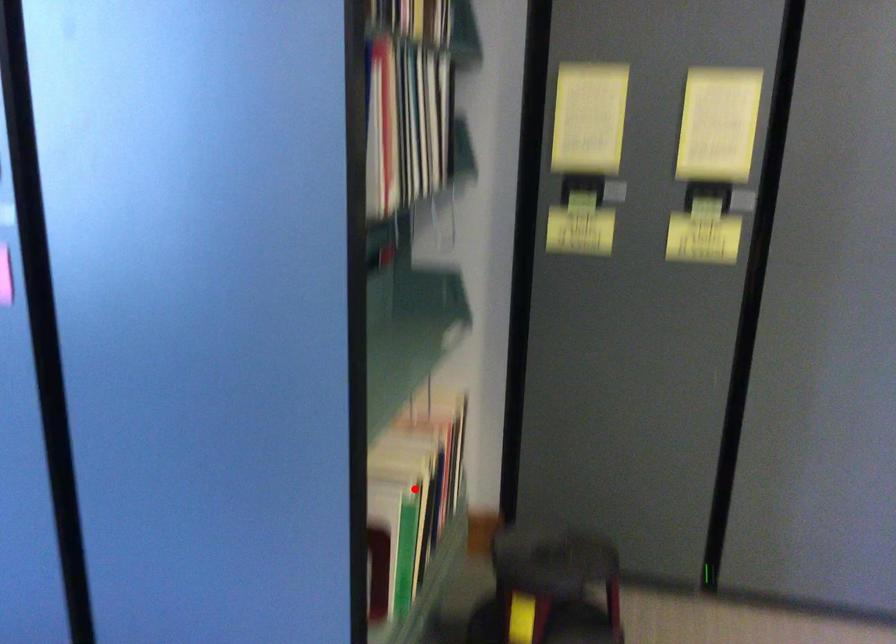
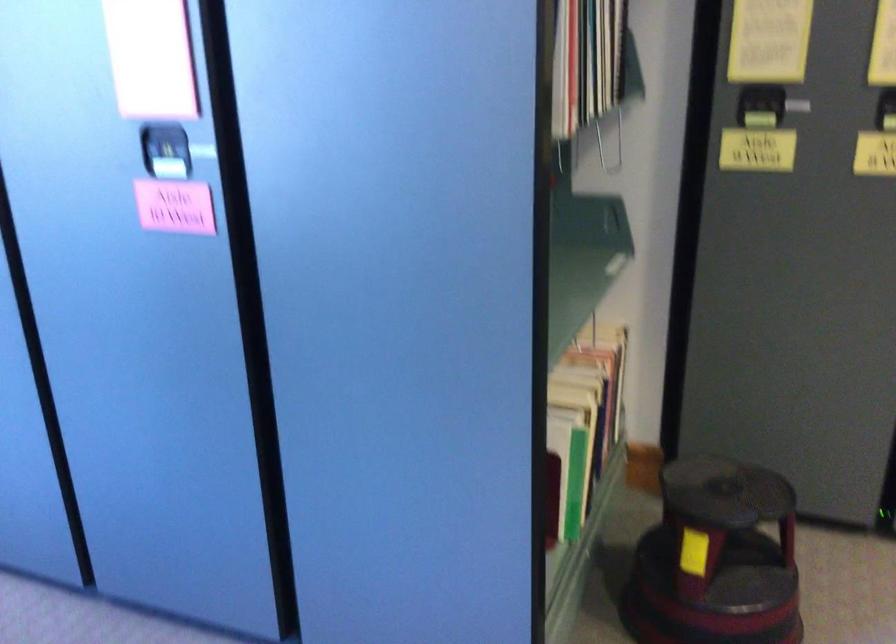
In the second image, find the point that corresponds to the highlighted location in the first image.

(584, 413)